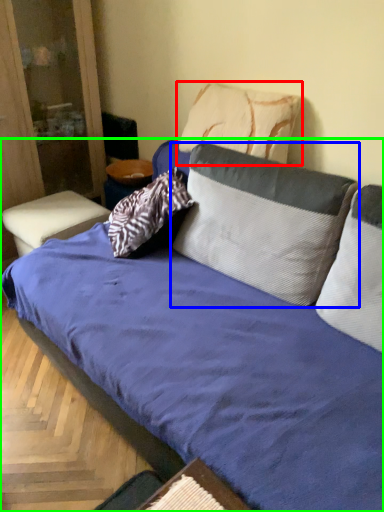
Question: Which object is positioned farthest from pillow (highlighted by a red box)? Select from pillow (highlighted by a blue box) and studio couch (highlighted by a green box).

Choices:
 (A) pillow
 (B) studio couch

Answer: (B)